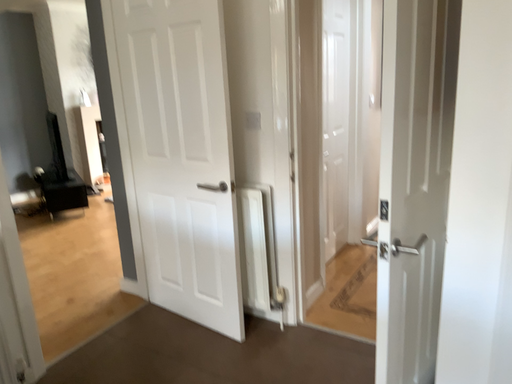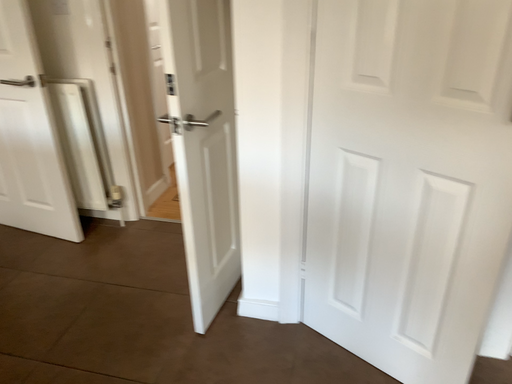
Question: How did the camera likely rotate when shooting the video?

Choices:
 (A) rotated right
 (B) rotated left

Answer: (A)